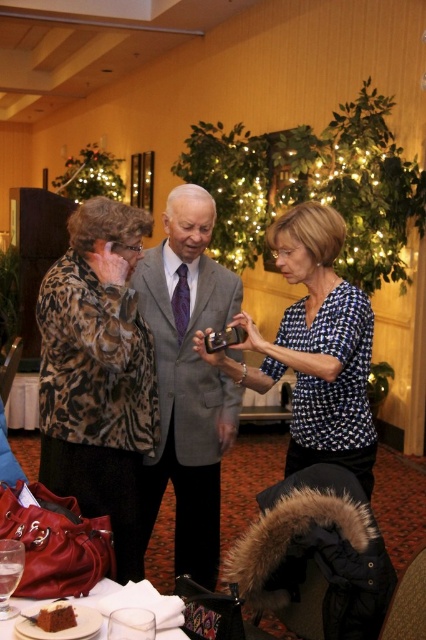
Question: Is blue dotted blouse at center closer to the viewer compared to chocolate cake at lower left?

Choices:
 (A) yes
 (B) no

Answer: (B)

Question: Which object is the closest to the chocolate cake at lower left?

Choices:
 (A) matte brown cake at lower left
 (B) gray suit at center

Answer: (A)

Question: Based on their relative distances, which object is farther from the gray suit at center?

Choices:
 (A) matte brown cake at lower left
 (B) blue dotted blouse at center

Answer: (A)

Question: Does leopard print jacket at left appear on the right side of gray suit at center?

Choices:
 (A) no
 (B) yes

Answer: (A)

Question: From the image, what is the correct spatial relationship of gray suit at center in relation to chocolate cake at lower left?

Choices:
 (A) above
 (B) below

Answer: (A)

Question: Estimate the real-world distances between objects in this image. Which object is closer to the blue dotted blouse at center?

Choices:
 (A) chocolate cake at lower left
 (B) leopard print jacket at left

Answer: (B)